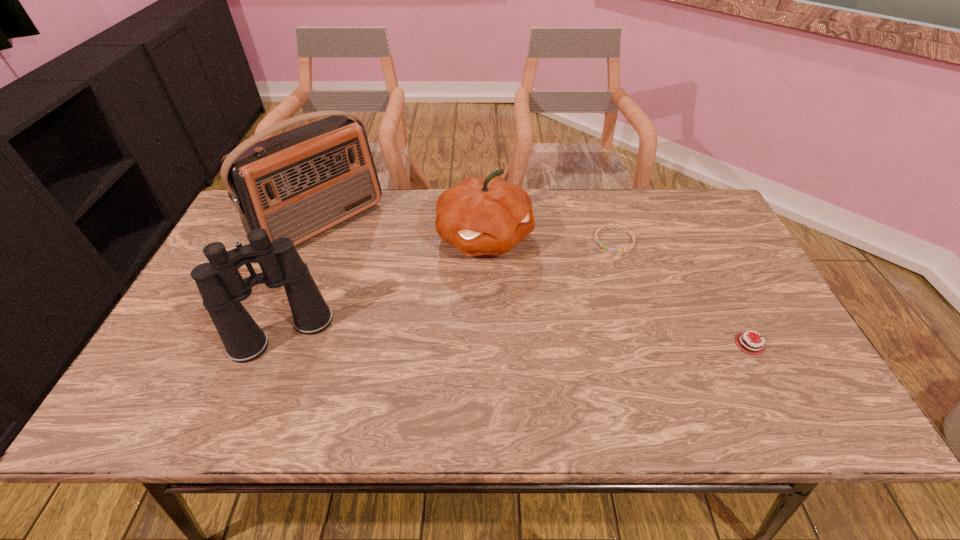
I want to click on vacant point located between the radio receiver and the rightmost object, so click(x=536, y=284).

The height and width of the screenshot is (540, 960). I want to click on free space between the third tallest object and the radio receiver, so click(403, 230).

The width and height of the screenshot is (960, 540). What are the coordinates of `unoccupied area between the binoculars and the third shortest object` in the screenshot? It's located at (383, 286).

Find the location of a particular element. This screenshot has height=540, width=960. vacant region between the shortest object and the third object from left to right is located at coordinates (549, 239).

What are the coordinates of `free space between the third object from right to left and the radio receiver` in the screenshot? It's located at (403, 230).

Locate an element on the screen. vacant space in between the binoculars and the shortest object is located at coordinates (448, 287).

The image size is (960, 540). Identify the location of object that is the third closest one to the second shortest object. (299, 183).

Find the location of a particular element. This screenshot has width=960, height=540. object that ranks as the second closest to the radio receiver is located at coordinates (479, 216).

Where is `free location that satisfies the following two spatial constraints: 1. on the back side of the third shortest object; 2. on the left side of the binoculars`? Image resolution: width=960 pixels, height=540 pixels. free location that satisfies the following two spatial constraints: 1. on the back side of the third shortest object; 2. on the left side of the binoculars is located at coordinates (320, 237).

Identify the location of free space that satisfies the following two spatial constraints: 1. on the front side of the radio receiver; 2. on the right side of the second object from right to left. (314, 240).